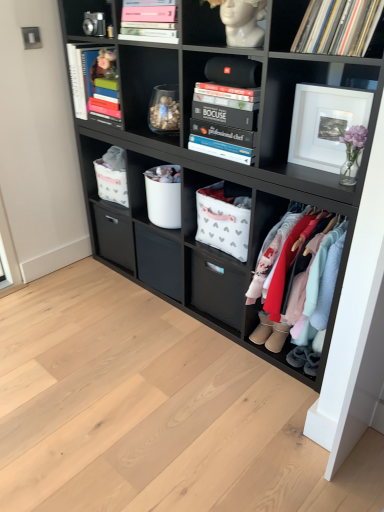
Question: Does white fabric basket at center, marked as the fourth shelf in a top-to-bottom arrangement, have a lesser height compared to black hardcover books at center, which is the 5th shelf from bottom to top?

Choices:
 (A) no
 (B) yes

Answer: (A)

Question: Is white fabric basket at center, marked as the fourth shelf in a top-to-bottom arrangement, positioned with its back to black hardcover books at center, the 2th shelf in the top-to-bottom sequence?

Choices:
 (A) yes
 (B) no

Answer: (B)

Question: Is white fabric basket at center, marked as the fourth shelf in a top-to-bottom arrangement, bigger than black hardcover books at center, which is the 5th shelf from bottom to top?

Choices:
 (A) yes
 (B) no

Answer: (B)

Question: From the image's perspective, is white fabric basket at center, marked as the fourth shelf in a top-to-bottom arrangement, below black hardcover books at center, the 2th shelf in the top-to-bottom sequence?

Choices:
 (A) yes
 (B) no

Answer: (A)

Question: Does white fabric basket at center, placed as the 3th shelf when sorted from bottom to top, have a smaller size compared to black hardcover books at center, the 2th shelf in the top-to-bottom sequence?

Choices:
 (A) yes
 (B) no

Answer: (A)

Question: Would you say black vinyl records at upper right, which is the 6th shelf from bottom to top, is inside or outside pink matte book at upper center, which is the second magazine from left to right?

Choices:
 (A) outside
 (B) inside

Answer: (A)

Question: Considering the positions of point (286, 27) and point (165, 38), is point (286, 27) closer or farther from the camera than point (165, 38)?

Choices:
 (A) farther
 (B) closer

Answer: (B)

Question: Is black vinyl records at upper right, the first shelf in the top-to-bottom sequence, to the left or to the right of pink matte book at upper center, which is the second magazine from left to right, in the image?

Choices:
 (A) right
 (B) left

Answer: (A)

Question: Looking at the image, does black vinyl records at upper right, which is the 6th shelf from bottom to top, seem bigger or smaller compared to pink matte book at upper center, acting as the first magazine starting from the right?

Choices:
 (A) small
 (B) big

Answer: (A)

Question: From a real-world perspective, is white matte picture frame at upper right physically located above or below metallic silver camera at upper left?

Choices:
 (A) below
 (B) above

Answer: (A)

Question: Is white matte picture frame at upper right inside or outside of metallic silver camera at upper left?

Choices:
 (A) inside
 (B) outside

Answer: (B)

Question: Looking at their shapes, would you say white matte picture frame at upper right is wider or thinner than metallic silver camera at upper left?

Choices:
 (A) thin
 (B) wide

Answer: (A)

Question: Based on their positions, is white matte picture frame at upper right located to the left or right of metallic silver camera at upper left?

Choices:
 (A) left
 (B) right

Answer: (B)

Question: In terms of width, does gray suede booties at lower right, which is counted as the first footwear, starting from the right, look wider or thinner when compared to white fabric basket at center, the 5th shelf viewed from the top?

Choices:
 (A) thin
 (B) wide

Answer: (A)

Question: Considering the relative positions of gray suede booties at lower right, which is counted as the first footwear, starting from the right, and white fabric basket at center, which ranks as the 2th shelf in bottom-to-top order, in the image provided, is gray suede booties at lower right, which is counted as the first footwear, starting from the right, to the left or to the right of white fabric basket at center, which ranks as the 2th shelf in bottom-to-top order,?

Choices:
 (A) right
 (B) left

Answer: (A)